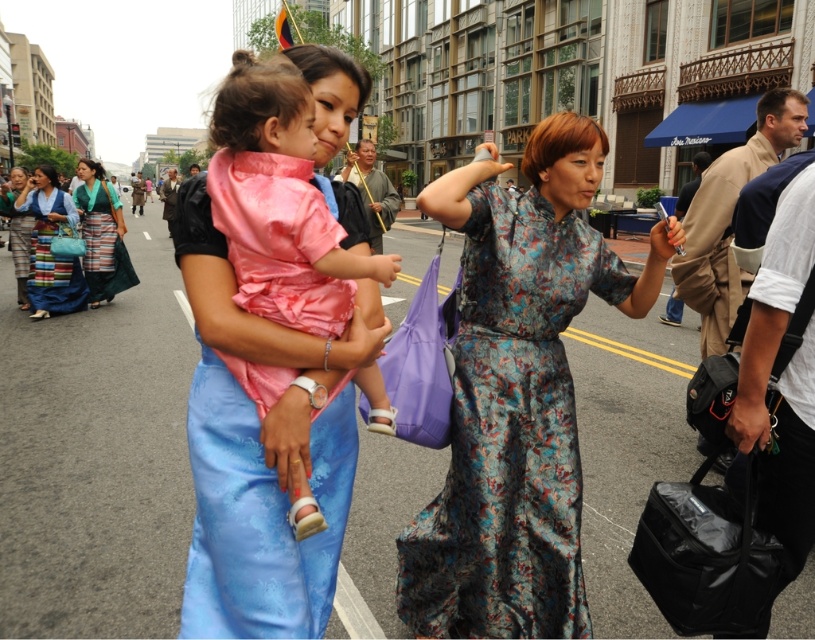
You are standing at the origin point looking towards the two points in the scene. Which point is closer to you, point (x=346, y=200) or point (x=53, y=304)?

Point (x=346, y=200) is in front of point (x=53, y=304), so it is closer to you.

You are a photographer trying to capture both the silky pink dress at center and the blue silk dress at center in a single frame. Based on their positions, which dress is closer to the camera?

The silky pink dress at center is closer to the camera because it is positioned under the blue silk dress at center, indicating it is in front.

You are a photographer trying to capture the child in the silky pink dress at center and the woman in the blue silk dress at center. Which one will appear larger in your photo?

The silky pink dress at center will appear larger in the photo because it is closer to the viewer than the blue silk dress at center.